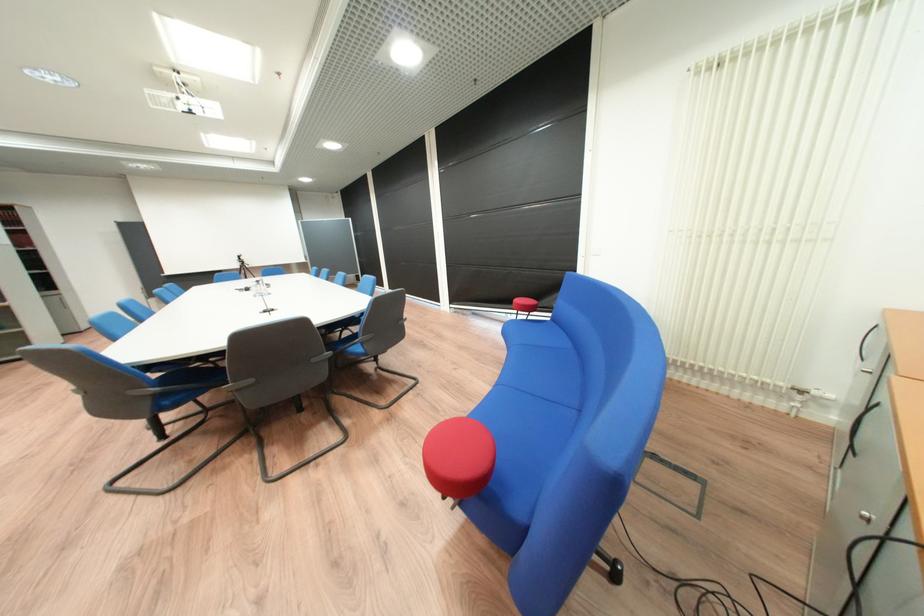
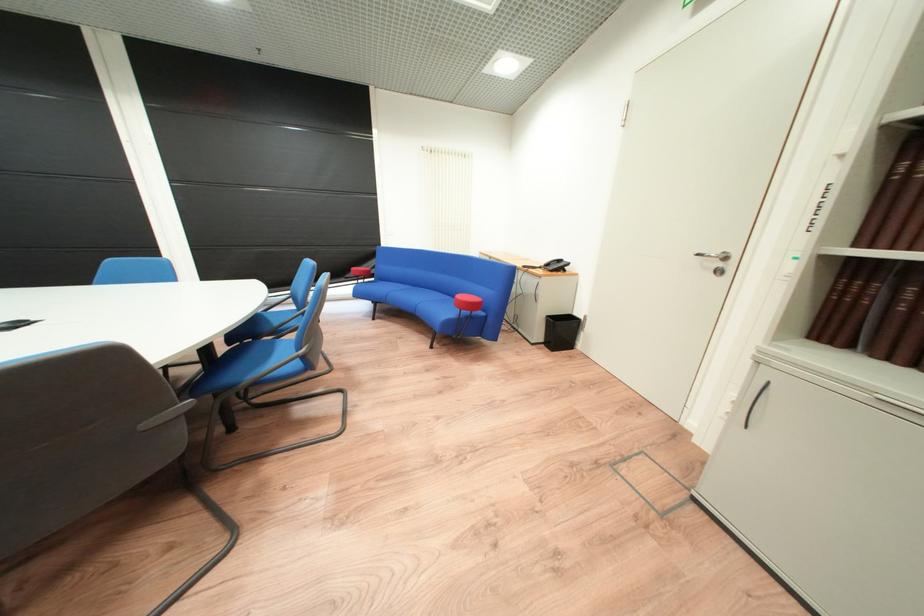
In the second image, find the point that corresponds to point 561,315 in the first image.

(383, 280)